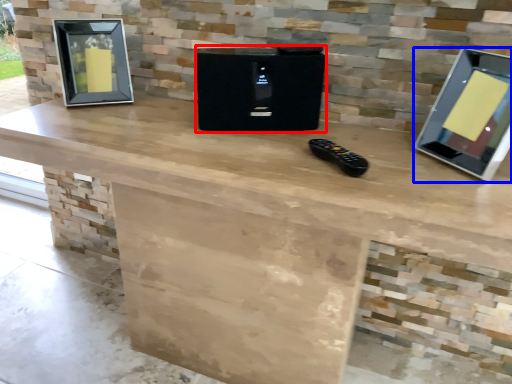
Question: Which point is closer to the camera, appliance (highlighted by a red box) or computer monitor (highlighted by a blue box)?

Choices:
 (A) appliance
 (B) computer monitor

Answer: (B)